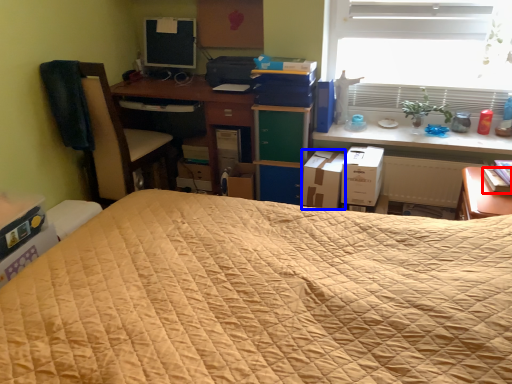
Question: Which of the following is the closest to the observer, paperback book (highlighted by a red box) or cardboard box (highlighted by a blue box)?

Choices:
 (A) paperback book
 (B) cardboard box

Answer: (A)